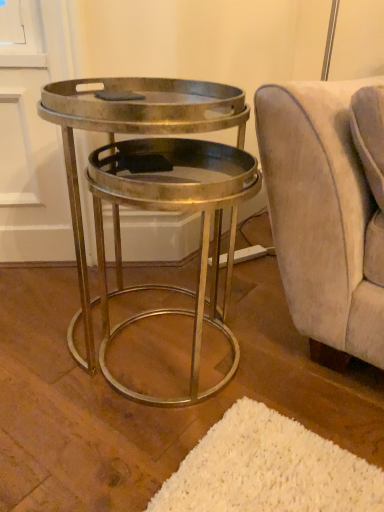
You are a GUI agent. You are given a task and a screenshot of the screen. Output one action in this format:
    pyautogui.click(x=<x>, y=<y>)
    Task: Click on the metallic/golden tray table at center
    The image size is (384, 512).
    Given the screenshot: What is the action you would take?
    pyautogui.click(x=156, y=186)

Image resolution: width=384 pixels, height=512 pixels. What do you see at coordinates (156, 186) in the screenshot? I see `metallic/golden tray table at center` at bounding box center [156, 186].

Image resolution: width=384 pixels, height=512 pixels. Find the location of `metallic/golden tray table at center`. metallic/golden tray table at center is located at coordinates (156, 186).